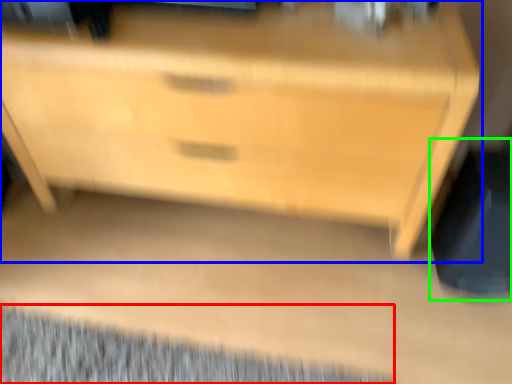
Question: Estimate the real-world distances between objects in this image. Which object is farther from mat (highlighted by a red box), chest of drawers (highlighted by a blue box) or swivel chair (highlighted by a green box)?

Choices:
 (A) chest of drawers
 (B) swivel chair

Answer: (B)